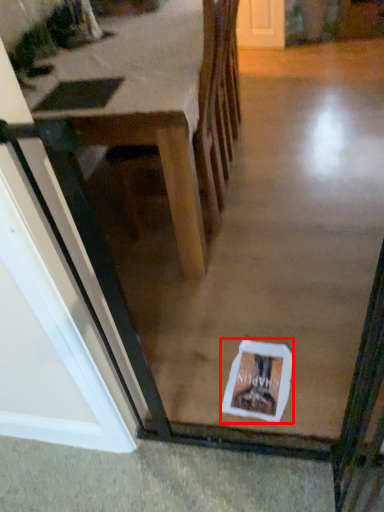
Question: In this image, where is postcard (annotated by the red box) located relative to table?

Choices:
 (A) right
 (B) left

Answer: (A)